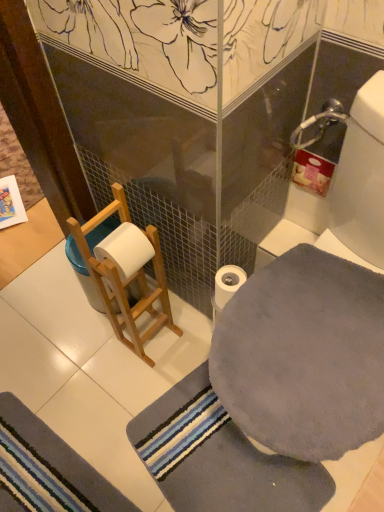
Question: Does point (241, 279) appear closer or farther from the camera than point (56, 443)?

Choices:
 (A) farther
 (B) closer

Answer: (B)

Question: Considering their positions, is white matte toilet paper at center located in front of or behind gray plush bath mat at lower left?

Choices:
 (A) front
 (B) behind

Answer: (B)

Question: Which is farther from the gray plush bath mat at lower left?

Choices:
 (A) wooden ladder at left
 (B) gray soft bath towel at lower right, arranged as the first bath towel when ordered from the bottom
 (C) white matte toilet paper at center
 (D) gray soft bath towel at right, which is the 1th bath towel from top to bottom

Answer: (D)

Question: Considering the real-world distances, which object is farthest from the gray soft bath towel at right, marked as the second bath towel in a bottom-to-top arrangement?

Choices:
 (A) gray plush bath mat at lower left
 (B) gray soft bath towel at lower right, arranged as the first bath towel when ordered from the bottom
 (C) wooden ladder at left
 (D) white matte toilet paper at center

Answer: (A)